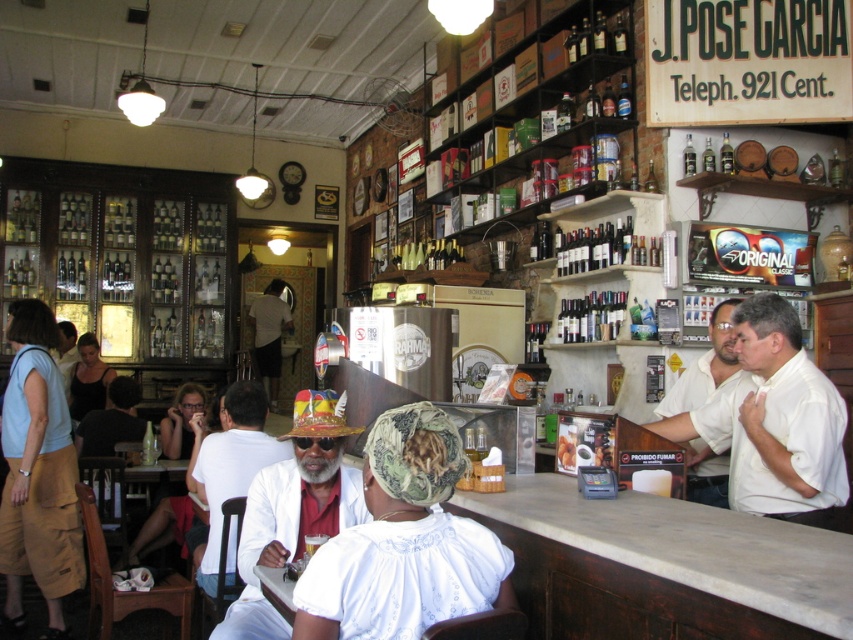
You are a customer at the bar and want to order a drink. You notice two white items in the scene. One is the white shirt at bar and the other is the white matte hat at center. Which white item is positioned higher up in the image?

The white shirt at bar is above the white matte hat at center, so the white shirt at bar is positioned higher up in the image.

You are a customer at the bar and notice two shirts hanging on a rack near the entrance. The light blue cotton shirt at left and the black fabric top at left are both on display. Which shirt is located to the right of the other?

The light blue cotton shirt at left is positioned on the right side of black fabric top at left, so the light blue cotton shirt at left is to the right of the black fabric top at left.